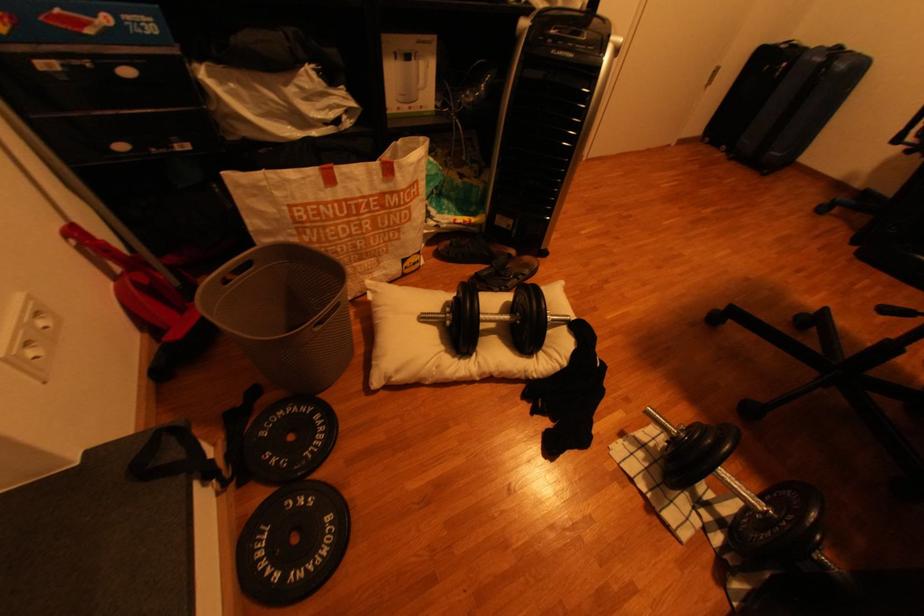
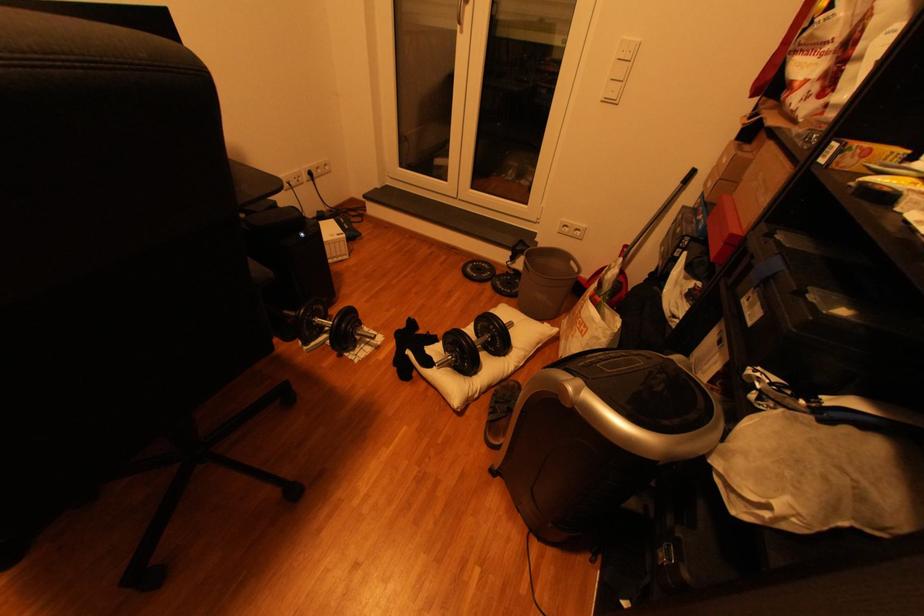
Find the pixel in the second image that matches point 325,419 in the first image.

(518, 292)